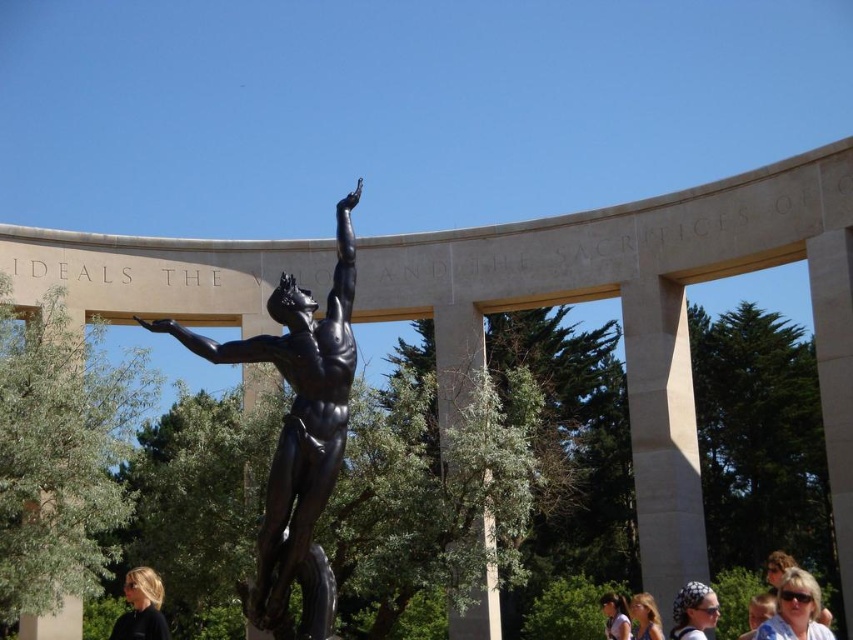
Question: Is matte black hair at lower left bigger than matte black hair at lower right?

Choices:
 (A) yes
 (B) no

Answer: (A)

Question: Among these objects, which one is nearest to the camera?

Choices:
 (A) white printed headscarf at lower center
 (B) light brown hair at lower center

Answer: (A)

Question: Which of the following is the closest to the observer?

Choices:
 (A) white printed headscarf at lower center
 (B) matte black hair at lower left
 (C) matte black sunglasses at lower right

Answer: (C)

Question: Is bronze statue at center to the left of matte black hair at lower left from the viewer's perspective?

Choices:
 (A) yes
 (B) no

Answer: (B)

Question: Which of the following is the closest to the observer?

Choices:
 (A) (144, 570)
 (B) (676, 611)

Answer: (A)

Question: Does matte black hair at lower left have a lesser width compared to matte black hair at lower right?

Choices:
 (A) no
 (B) yes

Answer: (A)